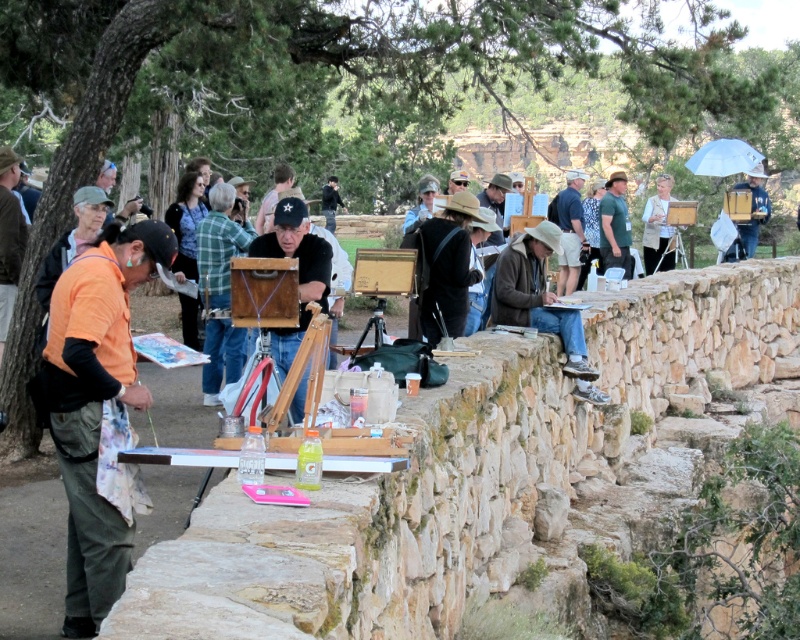
Question: Is matte black cap at center wider than matte black easel at upper center?

Choices:
 (A) yes
 (B) no

Answer: (B)

Question: Estimate the real-world distances between objects in this image. Which object is farther from the matte black easel at upper center?

Choices:
 (A) dark blue jeans at center
 (B) matte black cap at center
 (C) wooden easel at center

Answer: (B)

Question: Is matte black cap at center positioned at the back of wooden easel at center?

Choices:
 (A) yes
 (B) no

Answer: (A)

Question: Which point is closer to the camera?

Choices:
 (A) (284, 342)
 (B) (752, 204)
 (C) (562, 269)

Answer: (A)

Question: Which of the following is the farthest from the observer?

Choices:
 (A) wooden easel at center
 (B) matte black cap at center
 (C) dark blue jeans at center

Answer: (C)

Question: Can you confirm if matte black cap at center is thinner than wooden easel at center?

Choices:
 (A) no
 (B) yes

Answer: (B)